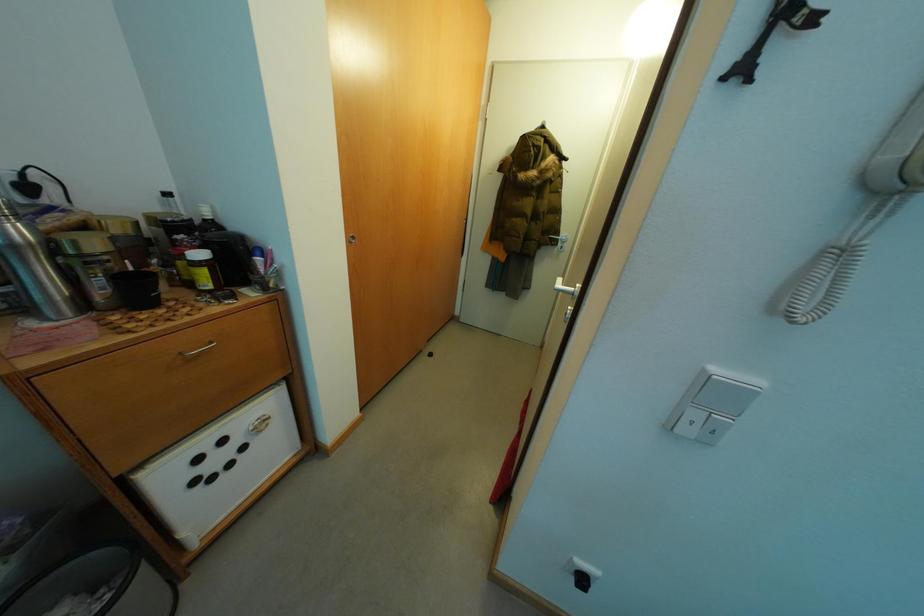
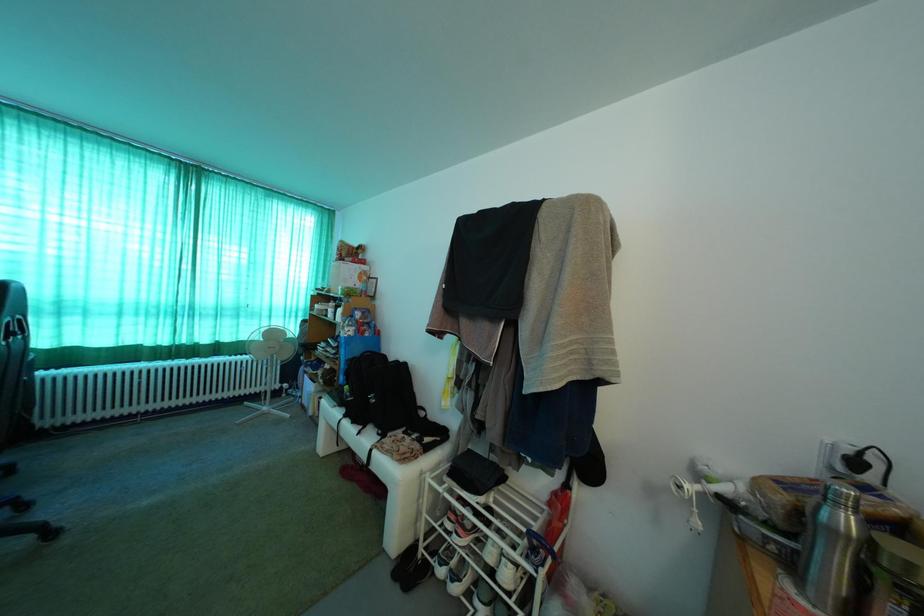
Question: The camera is either moving clockwise (left) or counter-clockwise (right) around the object. The first image is from the beginning of the video and the second image is from the end. Is the camera moving left or right when shooting the video?

Choices:
 (A) Left
 (B) Right

Answer: (B)